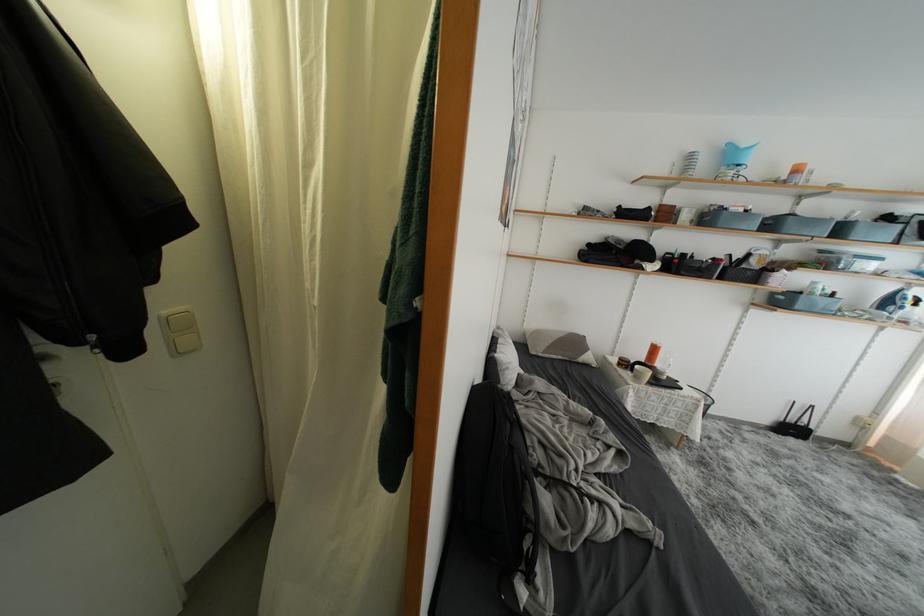
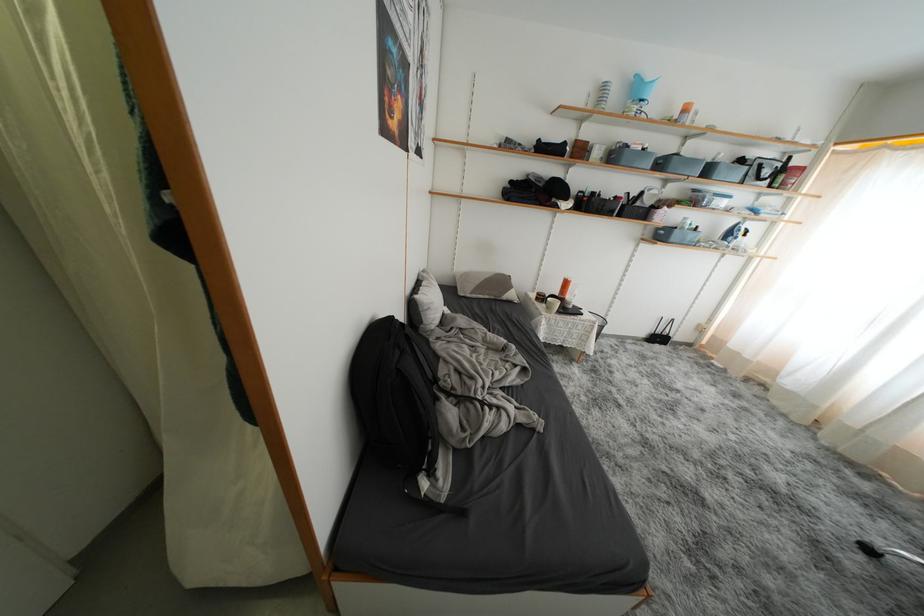
Question: The first image is from the beginning of the video and the second image is from the end. How did the camera likely rotate when shooting the video?

Choices:
 (A) Left
 (B) Right
 (C) Up
 (D) Down

Answer: (D)